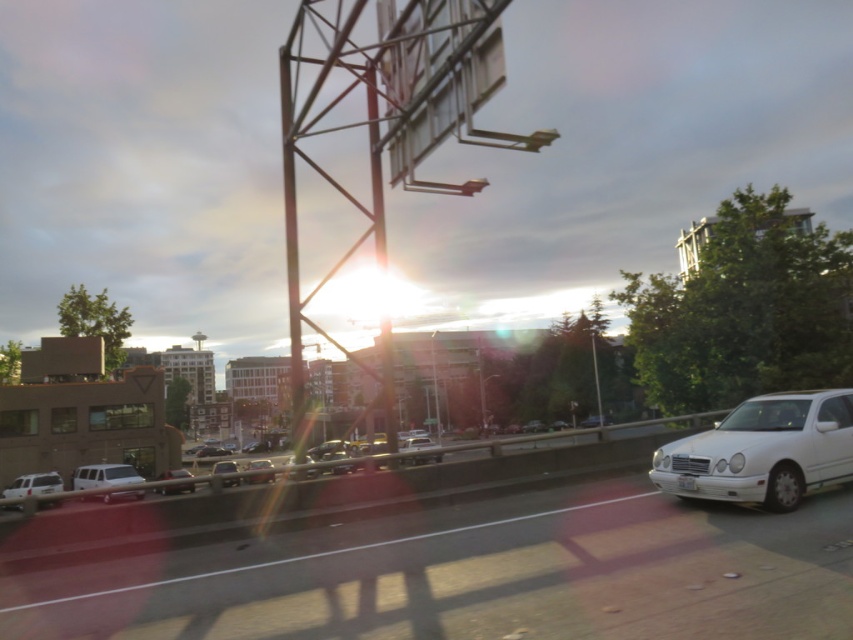
Question: Which of these objects is positioned farthest from the metallic silver sedan at center?

Choices:
 (A) white matte van at left
 (B) matte silver sedan at center
 (C) matte black sedan at center
 (D) white glossy car at center

Answer: (A)

Question: Does white glossy sedan at right have a larger size compared to white plastic license plate at center?

Choices:
 (A) yes
 (B) no

Answer: (A)

Question: Is white glossy sedan at right thinner than matte silver sedan at center?

Choices:
 (A) no
 (B) yes

Answer: (B)

Question: Which point is closer to the camera?

Choices:
 (A) white plastic license plate at center
 (B) shiny silver sedan at center
 (C) white matte van at left

Answer: (A)

Question: Which object appears closest to the camera in this image?

Choices:
 (A) white plastic license plate at center
 (B) white matte van at left
 (C) shiny silver sedan at center

Answer: (A)

Question: From the image, what is the correct spatial relationship of white matte van at left in relation to matte black sedan at center?

Choices:
 (A) above
 (B) below

Answer: (A)